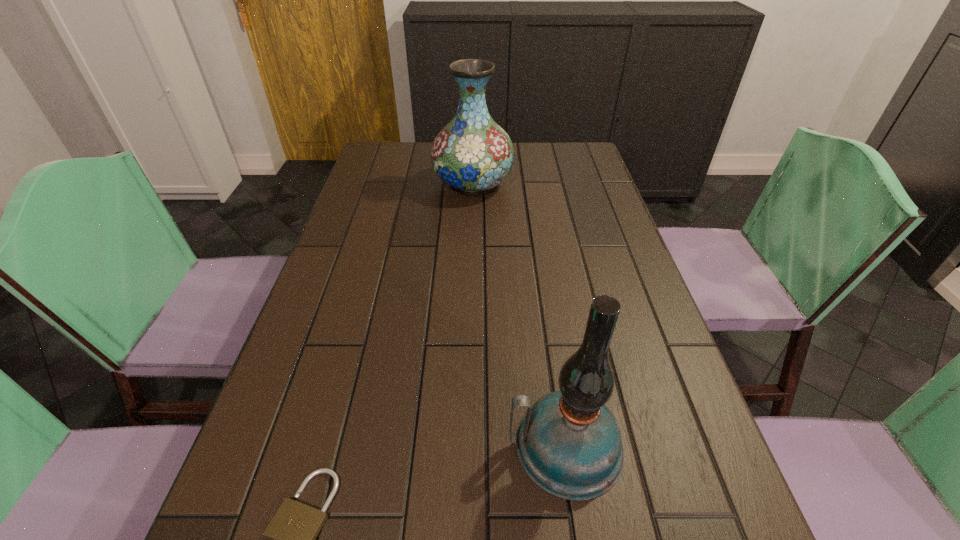
You are a GUI agent. You are given a task and a screenshot of the screen. Output one action in this format:
    pyautogui.click(x=<x>, y=<y>)
    Task: Click on the vase
    This screenshot has height=540, width=960.
    Given the screenshot: What is the action you would take?
    (472, 153)

I want to click on oil lamp, so click(569, 443).

Where is `vacant space located 0.130m on the right of the farthest object`? This screenshot has width=960, height=540. vacant space located 0.130m on the right of the farthest object is located at coordinates (554, 184).

Identify the location of free spot located 0.230m on the left of the oil lamp. (372, 446).

You are a GUI agent. You are given a task and a screenshot of the screen. Output one action in this format:
    pyautogui.click(x=<x>, y=<y>)
    Task: Click on the object that is positioned at the far edge
    The image size is (960, 540).
    Given the screenshot: What is the action you would take?
    pyautogui.click(x=472, y=153)

Find the location of a particular element. This screenshot has height=540, width=960. object that is at the right edge is located at coordinates (569, 443).

In the image, there is a desktop. Where is `vacant area at the far edge`? The image size is (960, 540). vacant area at the far edge is located at coordinates (534, 143).

In the image, there is a desktop. Identify the location of free region at the left edge. The image size is (960, 540). (400, 212).

Image resolution: width=960 pixels, height=540 pixels. In the image, there is a desktop. In order to click on vacant space at the right edge in this screenshot , I will do `click(618, 261)`.

Where is `blank space at the far right corner`? The image size is (960, 540). blank space at the far right corner is located at coordinates (587, 160).